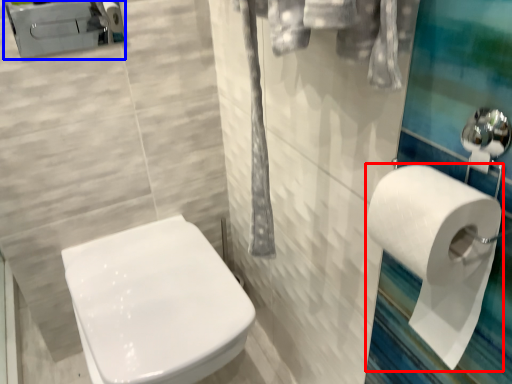
Question: Which object appears closest to the camera in this image, toilet paper (highlighted by a red box) or porcelain (highlighted by a blue box)?

Choices:
 (A) toilet paper
 (B) porcelain

Answer: (A)